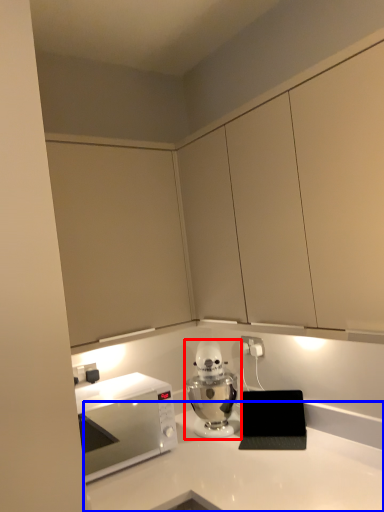
Question: Which object appears closest to the camera in this image, home appliance (highlighted by a red box) or countertop (highlighted by a blue box)?

Choices:
 (A) home appliance
 (B) countertop

Answer: (B)